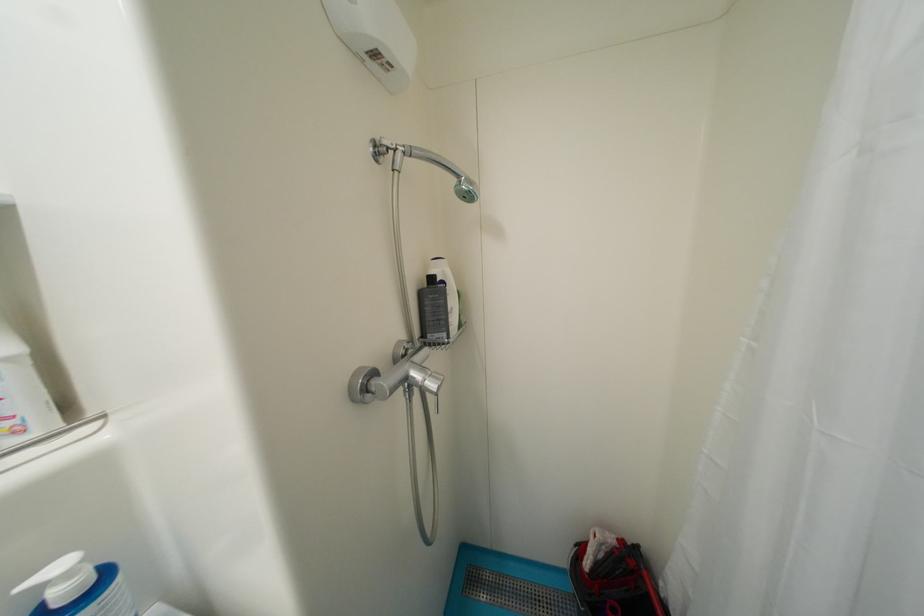
What do you see at coordinates (405, 379) in the screenshot? I see `the silver faucet knob` at bounding box center [405, 379].